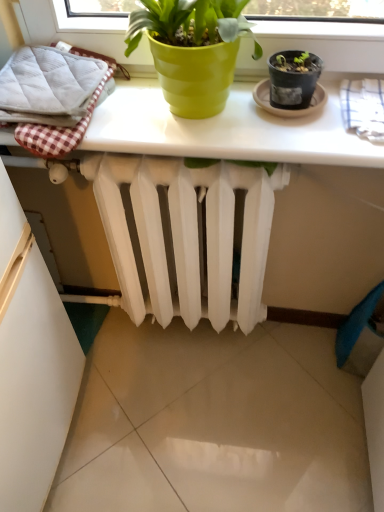
Question: Should I look upward or downward to see white glossy table at upper center?

Choices:
 (A) down
 (B) up

Answer: (B)

Question: Should I look upward or downward to see white quilted bath towel at left, acting as the 1th bath towel starting from the left?

Choices:
 (A) up
 (B) down

Answer: (A)

Question: From the image's perspective, would you say white quilted bath towel at left, acting as the 1th bath towel starting from the left, is positioned over white checkered bath towel at upper right, positioned as the first bath towel in right-to-left order?

Choices:
 (A) yes
 (B) no

Answer: (A)

Question: Is white quilted bath towel at left, acting as the 1th bath towel starting from the left, shorter than white checkered bath towel at upper right, positioned as the first bath towel in right-to-left order?

Choices:
 (A) yes
 (B) no

Answer: (B)

Question: Is white quilted bath towel at left, the second bath towel viewed from the right, oriented towards white checkered bath towel at upper right, positioned as the second bath towel in left-to-right order?

Choices:
 (A) no
 (B) yes

Answer: (A)

Question: Considering the relative sizes of white quilted bath towel at left, acting as the 1th bath towel starting from the left, and white checkered bath towel at upper right, positioned as the first bath towel in right-to-left order, in the image provided, is white quilted bath towel at left, acting as the 1th bath towel starting from the left, taller than white checkered bath towel at upper right, positioned as the first bath towel in right-to-left order,?

Choices:
 (A) yes
 (B) no

Answer: (A)

Question: From a real-world perspective, does white quilted bath towel at left, acting as the 1th bath towel starting from the left, sit lower than white checkered bath towel at upper right, positioned as the first bath towel in right-to-left order?

Choices:
 (A) yes
 (B) no

Answer: (B)

Question: Considering the relative positions of white quilted bath towel at left, acting as the 1th bath towel starting from the left, and white checkered bath towel at upper right, positioned as the first bath towel in right-to-left order, in the image provided, is white quilted bath towel at left, acting as the 1th bath towel starting from the left, to the left of white checkered bath towel at upper right, positioned as the first bath towel in right-to-left order, from the viewer's perspective?

Choices:
 (A) yes
 (B) no

Answer: (A)

Question: From the image's perspective, would you say white matte radiator at center is shown under white checkered bath towel at upper right, positioned as the first bath towel in right-to-left order?

Choices:
 (A) no
 (B) yes

Answer: (B)

Question: Can you confirm if white matte radiator at center is taller than white checkered bath towel at upper right, positioned as the first bath towel in right-to-left order?

Choices:
 (A) yes
 (B) no

Answer: (A)

Question: Considering the relative positions of white matte radiator at center and white checkered bath towel at upper right, positioned as the first bath towel in right-to-left order, in the image provided, is white matte radiator at center in front of white checkered bath towel at upper right, positioned as the first bath towel in right-to-left order,?

Choices:
 (A) yes
 (B) no

Answer: (B)

Question: From a real-world perspective, is white matte radiator at center beneath white checkered bath towel at upper right, positioned as the first bath towel in right-to-left order?

Choices:
 (A) yes
 (B) no

Answer: (A)

Question: Is there a large distance between white matte radiator at center and white checkered bath towel at upper right, positioned as the first bath towel in right-to-left order?

Choices:
 (A) yes
 (B) no

Answer: (B)

Question: Would you say white checkered bath towel at upper right, positioned as the first bath towel in right-to-left order, is part of white matte radiator at center's contents?

Choices:
 (A) no
 (B) yes

Answer: (A)

Question: Is white glossy table at upper center closer to the viewer compared to white matte radiator at center?

Choices:
 (A) no
 (B) yes

Answer: (B)